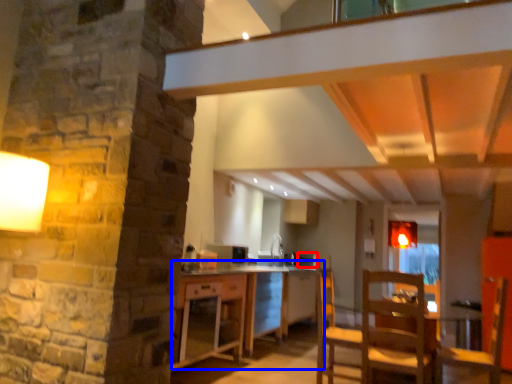
Question: Which of the following is the farthest to the observer, appliance (highlighted by a red box) or table (highlighted by a blue box)?

Choices:
 (A) appliance
 (B) table

Answer: (A)